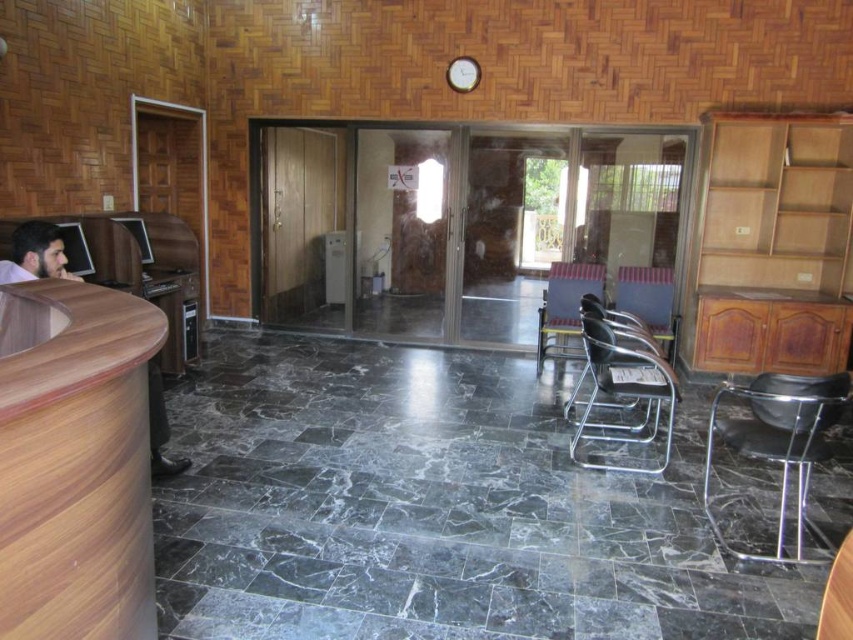
Looking at this image, which is more to the left, metallic gray chair at center or brown wood desk at left?

From the viewer's perspective, brown wood desk at left appears more on the left side.

Does metallic gray chair at center appear under brown wood desk at left?

Correct, metallic gray chair at center is located below brown wood desk at left.

Between point (663, 364) and point (32, 260), which one is positioned in front?

Positioned in front is point (32, 260).

Where is `metallic gray chair at center`? The height and width of the screenshot is (640, 853). metallic gray chair at center is located at coordinates (624, 387).

Does metallic black chair at lower right come in front of metallic gray chair at center?

Yes, metallic black chair at lower right is closer to the viewer.

Looking at this image, can you confirm if metallic black chair at lower right is thinner than metallic gray chair at center?

Yes, metallic black chair at lower right is thinner than metallic gray chair at center.

Is point (788, 436) closer to viewer compared to point (589, 324)?

Yes, it is in front of point (589, 324).

The width and height of the screenshot is (853, 640). I want to click on metallic black chair at lower right, so click(779, 444).

Which of these two, wooden reception desk at left or metallic black chair at lower right, stands shorter?

metallic black chair at lower right is shorter.

Based on the photo, can you confirm if wooden reception desk at left is smaller than metallic black chair at lower right?

No, wooden reception desk at left is not smaller than metallic black chair at lower right.

Is point (126, 339) closer to viewer compared to point (808, 448)?

That is True.

Find the location of a particular element. wooden reception desk at left is located at coordinates (76, 467).